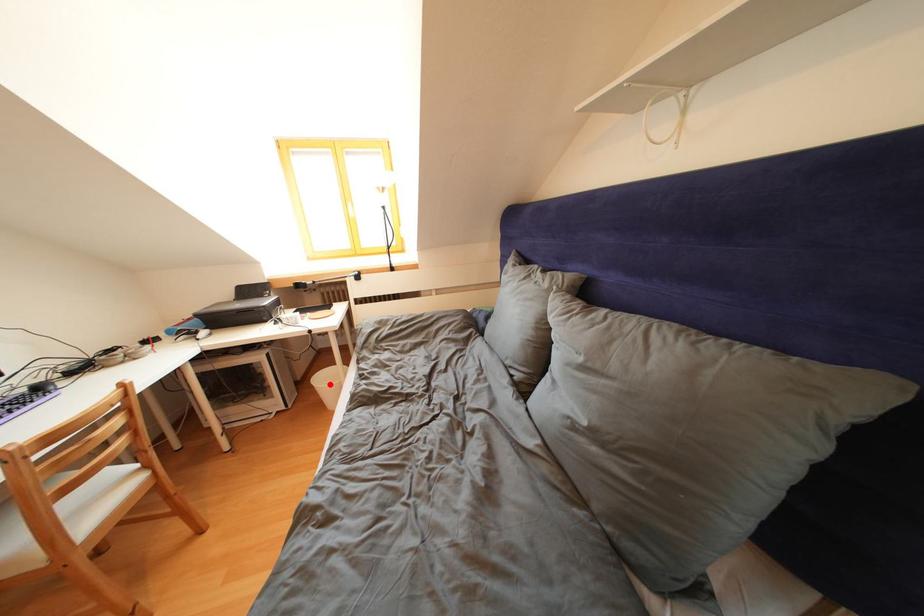
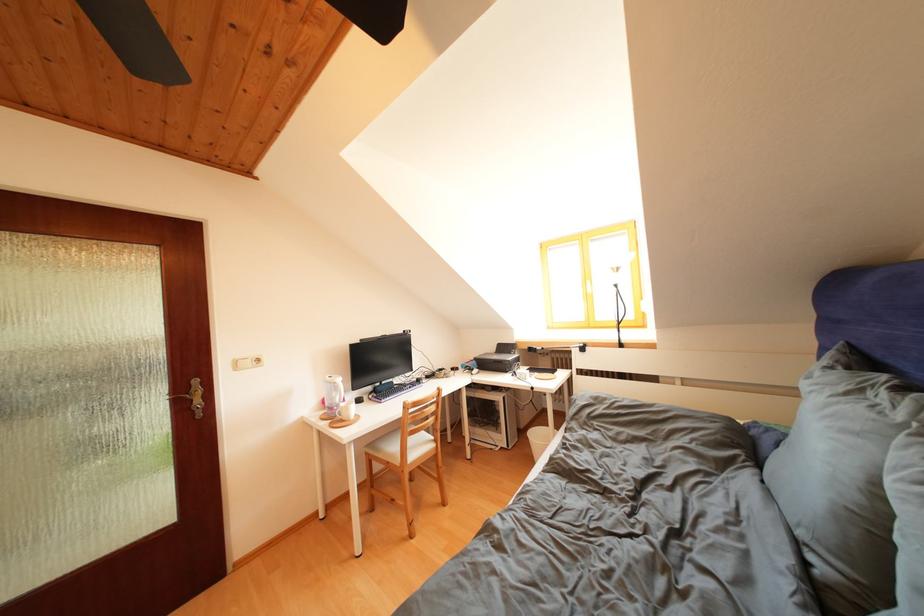
Where in the second image is the point corresponding to the highlighted location from the first image?

(542, 439)